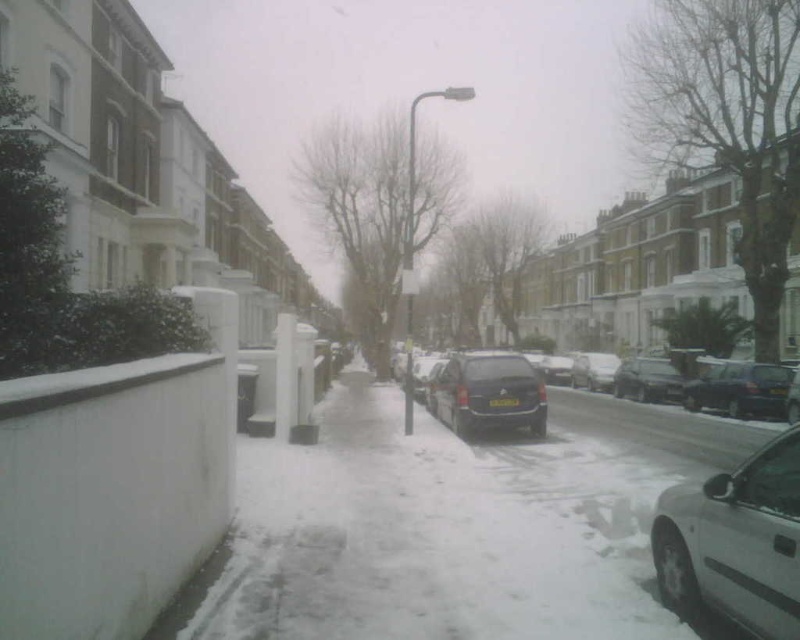
Between dark blue metallic car at right and matte black car at center, which one is positioned lower?

matte black car at center is lower down.

This screenshot has width=800, height=640. Identify the location of dark blue metallic car at right. (740, 388).

What do you see at coordinates (648, 380) in the screenshot? Image resolution: width=800 pixels, height=640 pixels. I see `matte black car at center` at bounding box center [648, 380].

Which is behind, point (658, 374) or point (601, 353)?

Positioned behind is point (601, 353).

Find the location of `matte black car at center`. matte black car at center is located at coordinates (648, 380).

Can you confirm if white snow-covered pavement at lower left is shorter than dark blue metallic car at right?

Yes.

Identify the location of white snow-covered pavement at lower left. (428, 538).